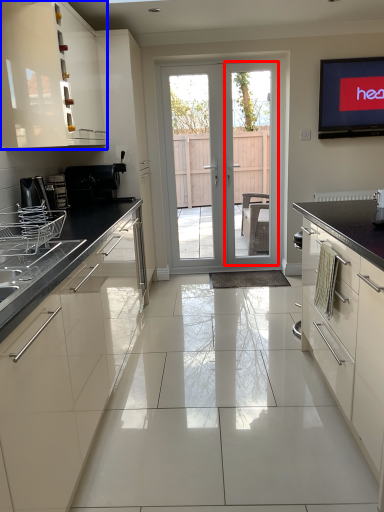
Question: Which point is further to the camera, screen door (highlighted by a red box) or cabinetry (highlighted by a blue box)?

Choices:
 (A) screen door
 (B) cabinetry

Answer: (A)